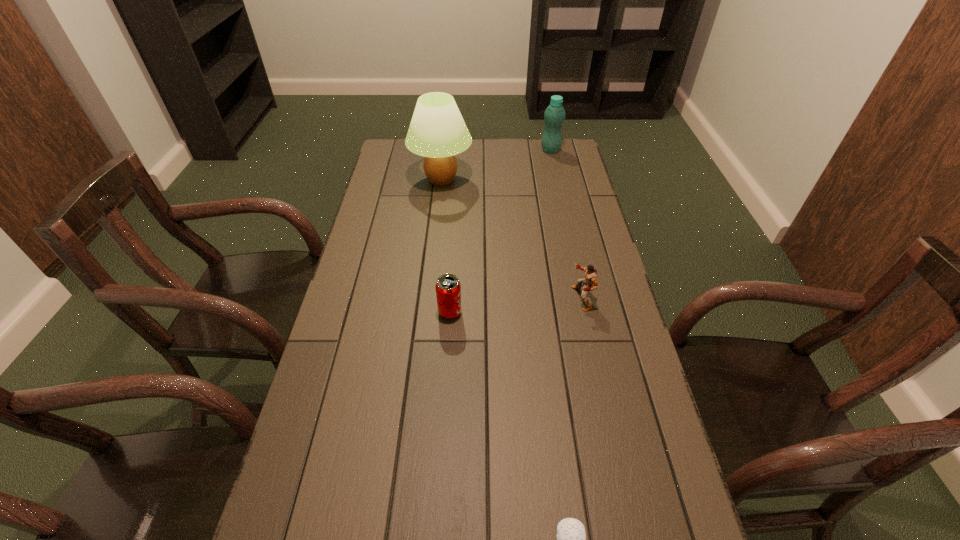
You are a GUI agent. You are given a task and a screenshot of the screen. Output one action in this format:
    pyautogui.click(x=<x>, y=<y>)
    Task: Click on the vacant space located 0.050m on the front-facing side of the puncher
    The width and height of the screenshot is (960, 540).
    Given the screenshot: What is the action you would take?
    click(555, 299)

Identify the location of vacant space located 0.350m on the back of the soda can. (455, 228).

At what (x,y) coordinates should I click in order to perform the action: click on lampshade that is at the far edge. Please return your answer as a coordinate pair (x, y). This screenshot has width=960, height=540. Looking at the image, I should click on (437, 131).

Where is `water bottle present at the far edge`? Image resolution: width=960 pixels, height=540 pixels. water bottle present at the far edge is located at coordinates (554, 116).

In order to click on object at the left edge in this screenshot , I will do `click(437, 131)`.

The image size is (960, 540). What are the coordinates of `water bottle located at the right edge` in the screenshot? It's located at (554, 116).

At what (x,y) coordinates should I click in order to perform the action: click on puncher that is at the right edge. Please return your answer as a coordinate pair (x, y). The image size is (960, 540). Looking at the image, I should click on (590, 278).

At what (x,y) coordinates should I click in order to perform the action: click on object located at the far left corner. Please return your answer as a coordinate pair (x, y). Looking at the image, I should click on (437, 131).

Where is `object present at the far right corner`? The width and height of the screenshot is (960, 540). object present at the far right corner is located at coordinates (554, 116).

Identify the location of free point at the far edge. point(476,144).